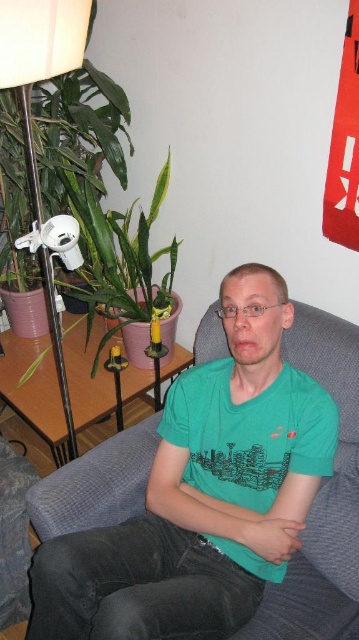
Question: Is green leafy plant at left smaller than fuzzy fabric couch at lower left?

Choices:
 (A) yes
 (B) no

Answer: (B)

Question: Can you confirm if green cotton t-shirt at center is positioned to the right of fuzzy fabric couch at lower left?

Choices:
 (A) no
 (B) yes

Answer: (B)

Question: Which of the following is the farthest from the observer?

Choices:
 (A) green leafy plant at left
 (B) fuzzy fabric couch at lower left
 (C) green cotton t-shirt at center

Answer: (A)

Question: Which object is positioned closest to the green cotton t-shirt at center?

Choices:
 (A) fuzzy fabric couch at lower left
 (B) green leafy plant at left

Answer: (A)

Question: Among these points, which one is farthest from the camera?

Choices:
 (A) (324, 444)
 (B) (173, 272)

Answer: (B)

Question: Does green cotton t-shirt at center have a smaller size compared to fuzzy fabric couch at lower left?

Choices:
 (A) no
 (B) yes

Answer: (A)